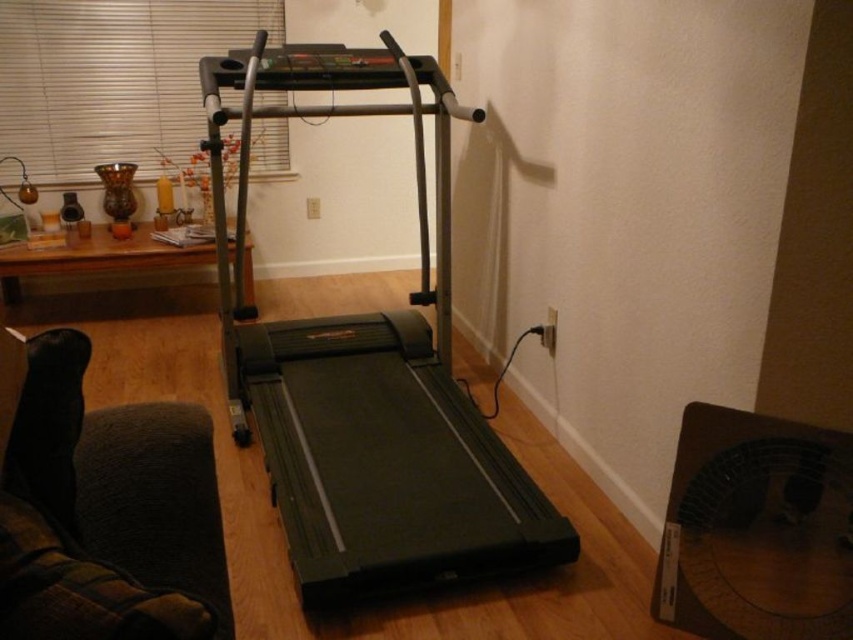
Which of these two, black plastic fan at lower right or brown wood table at left, stands shorter?

brown wood table at left

Which is more to the right, black plastic fan at lower right or brown wood table at left?

black plastic fan at lower right

Where is `black plastic fan at lower right`? black plastic fan at lower right is located at coordinates (756, 529).

Image resolution: width=853 pixels, height=640 pixels. I want to click on black plastic fan at lower right, so click(x=756, y=529).

Between point (453, 456) and point (21, 246), which one is positioned in front?

Positioned in front is point (453, 456).

Can you confirm if black rubber treadmill at center is wider than brown wood table at left?

No, black rubber treadmill at center is not wider than brown wood table at left.

Does point (526, 508) come closer to viewer compared to point (6, 291)?

That is True.

You are a GUI agent. You are given a task and a screenshot of the screen. Output one action in this format:
    pyautogui.click(x=<x>, y=<y>)
    Task: Click on the black rubber treadmill at center
    Image resolution: width=853 pixels, height=640 pixels.
    Given the screenshot: What is the action you would take?
    pyautogui.click(x=368, y=374)

Between black plastic fan at lower right and white textured blind at upper left, which one appears on the left side from the viewer's perspective?

Positioned to the left is white textured blind at upper left.

Consider the image. Which is more to the right, black plastic fan at lower right or white textured blind at upper left?

black plastic fan at lower right is more to the right.

What are the coordinates of `black plastic fan at lower right` in the screenshot? It's located at (756, 529).